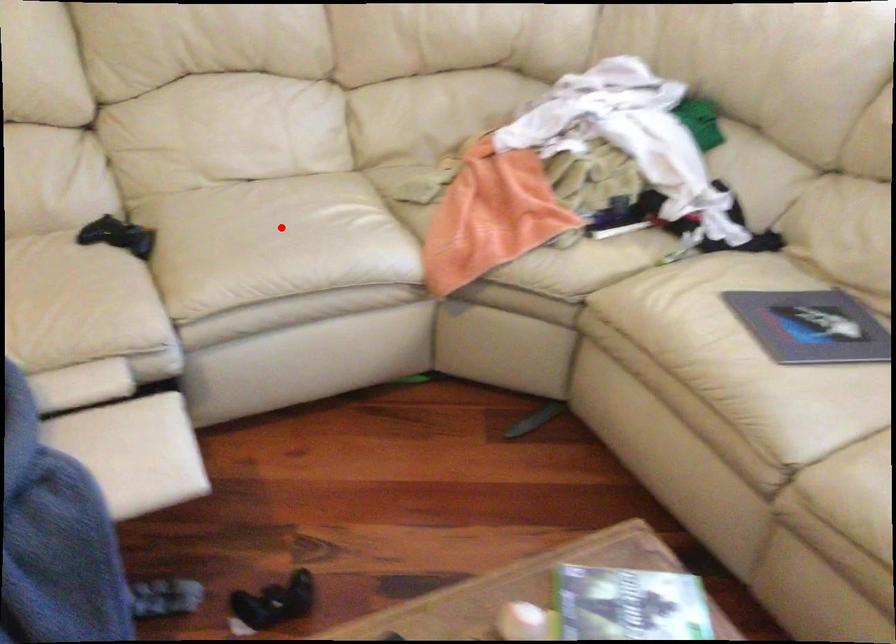
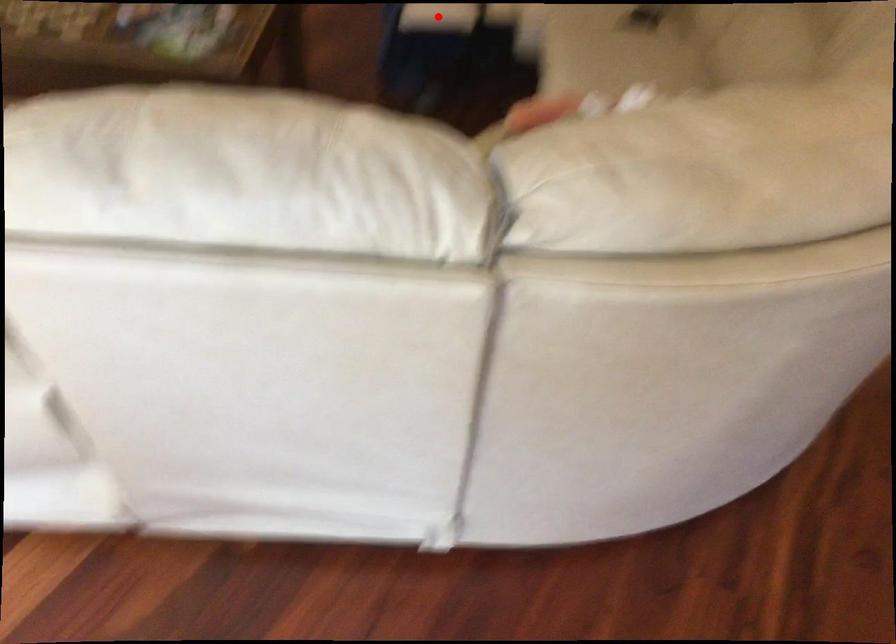
I am providing you with two images of the same scene from different viewpoints. A red point is marked on the first image and another point is marked on the second image. Is the red point in image1 aligned with the point shown in image2?

No